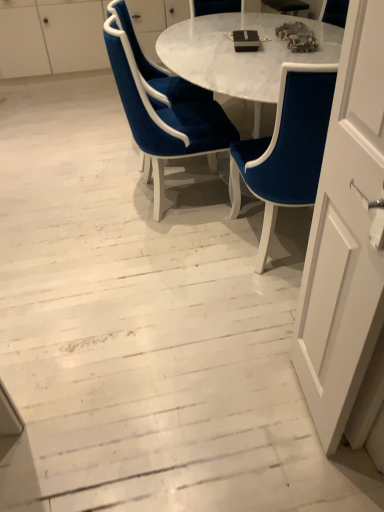
Identify the location of free space in front of velvet blue chair at center, which is the 1th chair from right to left. (246, 317).